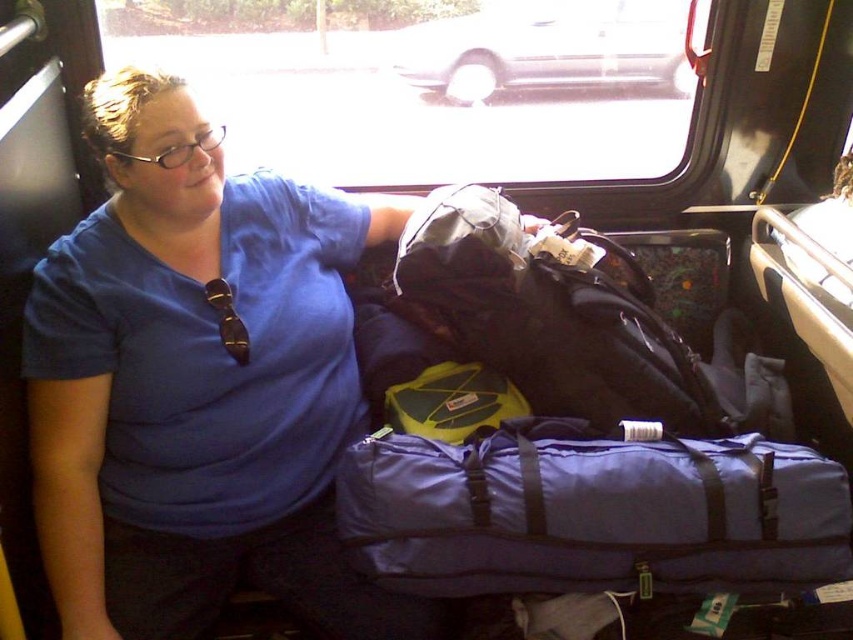
Who is positioned more to the right, blue cotton shirt at left or white matte car at upper center?

Positioned to the right is white matte car at upper center.

Which is in front, point (137, 438) or point (434, 28)?

Positioned in front is point (137, 438).

Is point (77, 506) closer to viewer compared to point (689, 70)?

Yes, point (77, 506) is closer to viewer.

You are a GUI agent. You are given a task and a screenshot of the screen. Output one action in this format:
    pyautogui.click(x=<x>, y=<y>)
    Task: Click on the blue cotton shirt at left
    The height and width of the screenshot is (640, 853).
    Given the screenshot: What is the action you would take?
    pyautogui.click(x=196, y=384)

Between point (843, 540) and point (404, 83), which one is positioned in front?

Point (843, 540) is more forward.

What do you see at coordinates (590, 513) in the screenshot? I see `purple nylon duffel bag at lower center` at bounding box center [590, 513].

Locate an element on the screen. purple nylon duffel bag at lower center is located at coordinates (590, 513).

Is point (329, 301) farther from viewer compared to point (416, 544)?

Yes, it is behind point (416, 544).

Measure the distance between point (283, 241) and camera.

Point (283, 241) is 4.34 feet from camera.

Is point (241, 380) positioned before point (840, 516)?

No, it is behind (840, 516).

Where is `blue cotton shirt at left`? blue cotton shirt at left is located at coordinates 196,384.